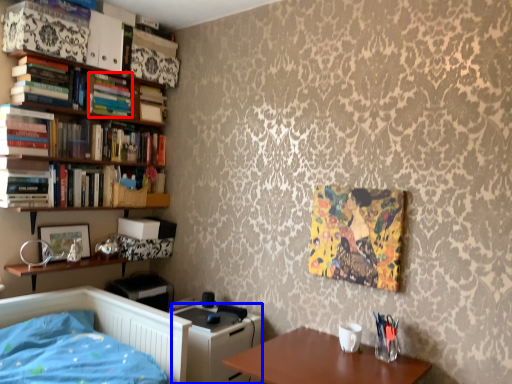
Question: Which point is further to the camera, book (highlighted by a red box) or file cabinet (highlighted by a blue box)?

Choices:
 (A) book
 (B) file cabinet

Answer: (A)